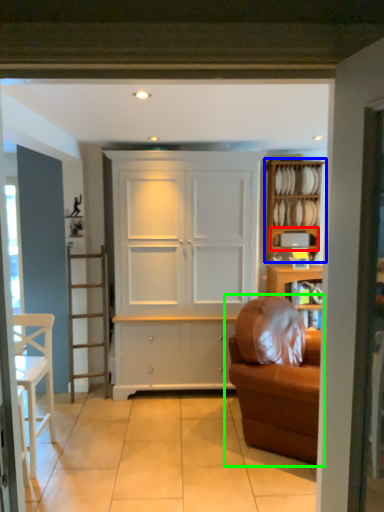
Question: Based on their relative distances, which object is nearer to shelf (highlighted by a red box)? Choose from shelf (highlighted by a blue box) and studio couch (highlighted by a green box).

Choices:
 (A) shelf
 (B) studio couch

Answer: (A)